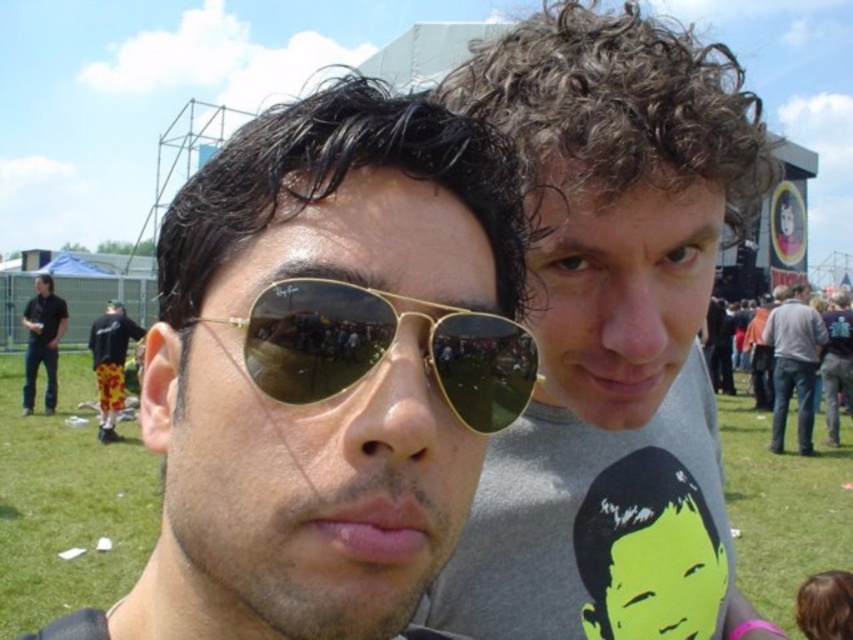
Looking at this image, you are standing at the stage in the distance and want to walk towards the two people in the image. Which point, point (793, 371) or point (38, 276), would you reach first?

Point (793, 371) is in front of point (38, 276), so you would reach point (793, 371) first.